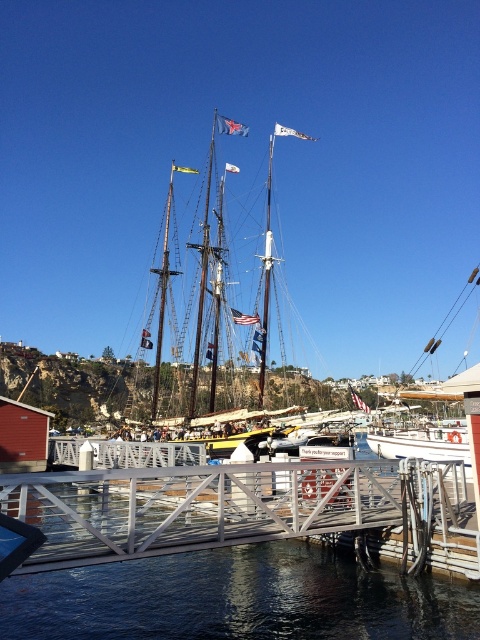
Who is positioned more to the left, clear water at center or white matte sailboat at center?

Positioned to the left is clear water at center.

Between clear water at center and white matte sailboat at center, which one is positioned lower?

clear water at center is below.

Who is more forward, (x=407, y=637) or (x=383, y=436)?

Point (x=407, y=637) is more forward.

You are a GUI agent. You are given a task and a screenshot of the screen. Output one action in this format:
    pyautogui.click(x=<x>, y=<y>)
    Task: Click on the clear water at center
    This screenshot has height=640, width=480.
    Given the screenshot: What is the action you would take?
    pos(238,600)

Measure the distance between clear water at center and wooden ship at center.

clear water at center is 110.62 feet away from wooden ship at center.

Find the location of a particular element. clear water at center is located at coordinates (238, 600).

Who is more distant from viewer, (148, 598) or (201, 282)?

Point (201, 282)

This screenshot has height=640, width=480. Identify the location of clear water at center. (238, 600).

Can you confirm if wooden ship at center is wider than white matte sailboat at center?

Incorrect, wooden ship at center's width does not surpass white matte sailboat at center's.

Does point (206, 269) come behind point (402, 451)?

Yes, point (206, 269) is behind point (402, 451).

Does point (275, 129) come in front of point (384, 445)?

No, it is behind (384, 445).

I want to click on wooden ship at center, so click(x=207, y=264).